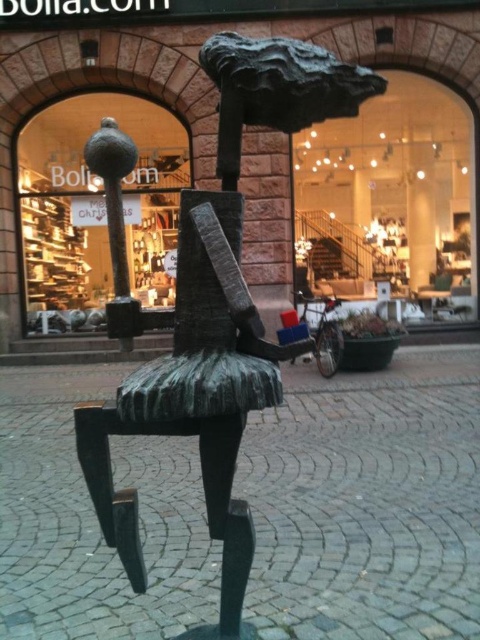
You are an art curator planning to move the matte glass vase at upper center and the metallic polished chair at center to a new exhibition space. If you want to maintain their original spatial relationship, where should you place the metallic polished chair relative to the matte glass vase?

The matte glass vase at upper center is above the metallic polished chair at center. Therefore, to maintain their original spatial relationship, the metallic polished chair should be placed below the matte glass vase.